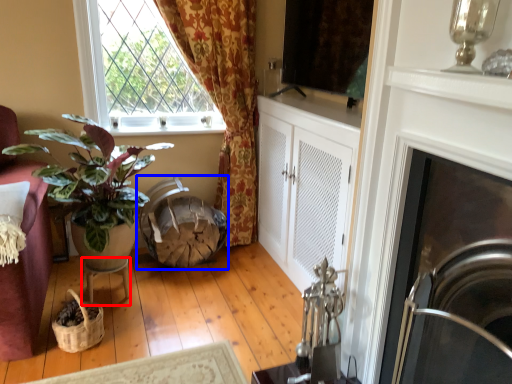
Question: Which point is further to the camera, table (highlighted by a red box) or swivel chair (highlighted by a blue box)?

Choices:
 (A) table
 (B) swivel chair

Answer: (B)